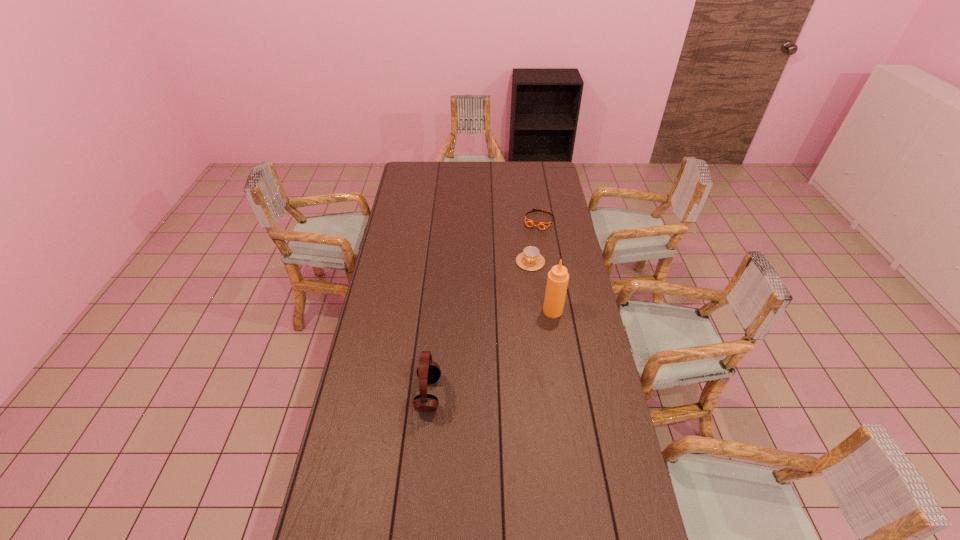
Image resolution: width=960 pixels, height=540 pixels. What are the coordinates of `the leftmost object` in the screenshot? It's located at (x=428, y=372).

The image size is (960, 540). Find the location of `the nearest object`. the nearest object is located at coordinates click(428, 372).

The width and height of the screenshot is (960, 540). Find the location of `the tallest object`. the tallest object is located at coordinates (557, 282).

You are a GUI agent. You are given a task and a screenshot of the screen. Output one action in this format:
    pyautogui.click(x=<x>, y=<y>)
    Task: Click on the condiment
    The image size is (960, 540).
    Given the screenshot: What is the action you would take?
    pyautogui.click(x=557, y=282)

You are a GUI agent. You are given a task and a screenshot of the screen. Output one action in this format:
    pyautogui.click(x=<x>, y=<y>)
    Task: Click on the farthest object
    
    Given the screenshot: What is the action you would take?
    pyautogui.click(x=542, y=225)

Image resolution: width=960 pixels, height=540 pixels. What are the coordinates of `goggles` in the screenshot? It's located at click(x=542, y=225).

You are a GUI agent. You are given a task and a screenshot of the screen. Output one action in this format:
    pyautogui.click(x=<x>, y=<y>)
    Task: Click on the third nearest object
    Image resolution: width=960 pixels, height=540 pixels.
    Given the screenshot: What is the action you would take?
    pyautogui.click(x=530, y=259)

This screenshot has width=960, height=540. What are the coordinates of `the second shortest object` in the screenshot? It's located at (530, 259).

Where is `free space located 0.300m on the ear pads of the nearest object`? The width and height of the screenshot is (960, 540). free space located 0.300m on the ear pads of the nearest object is located at coordinates (527, 394).

Identify the location of vacant space situated 0.070m on the back of the tallest object. (550, 292).